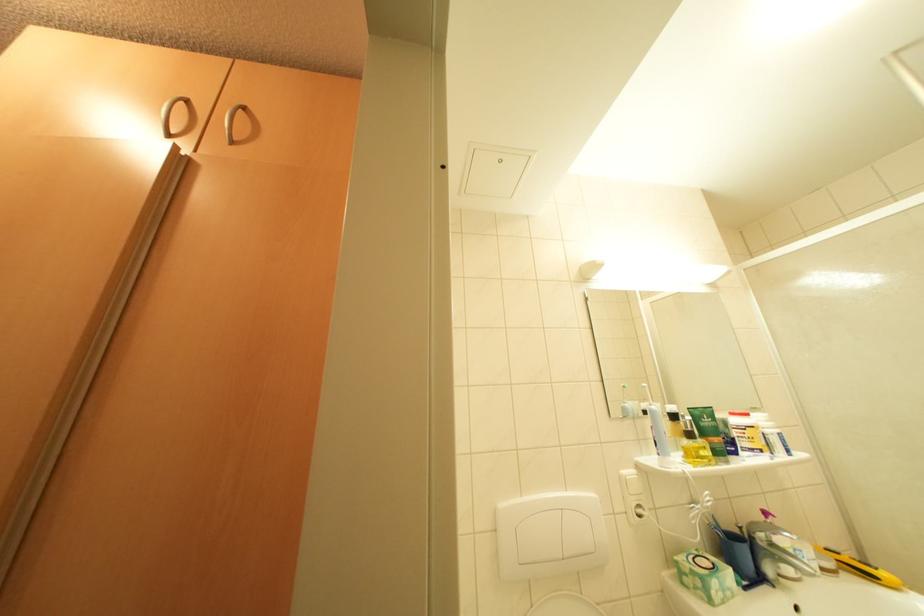
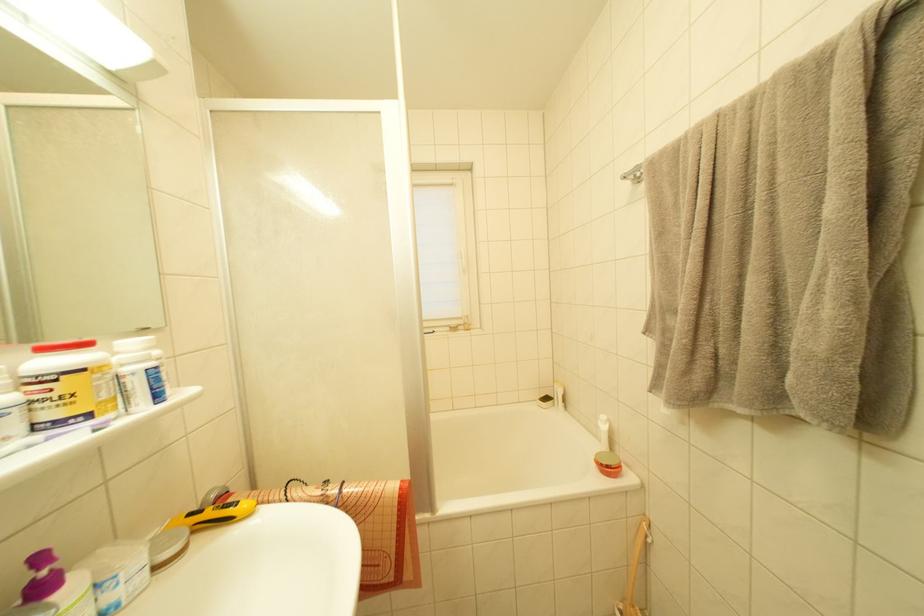
Where in the second image is the point corresponding to the point at 794,456 from the first image?

(163, 400)